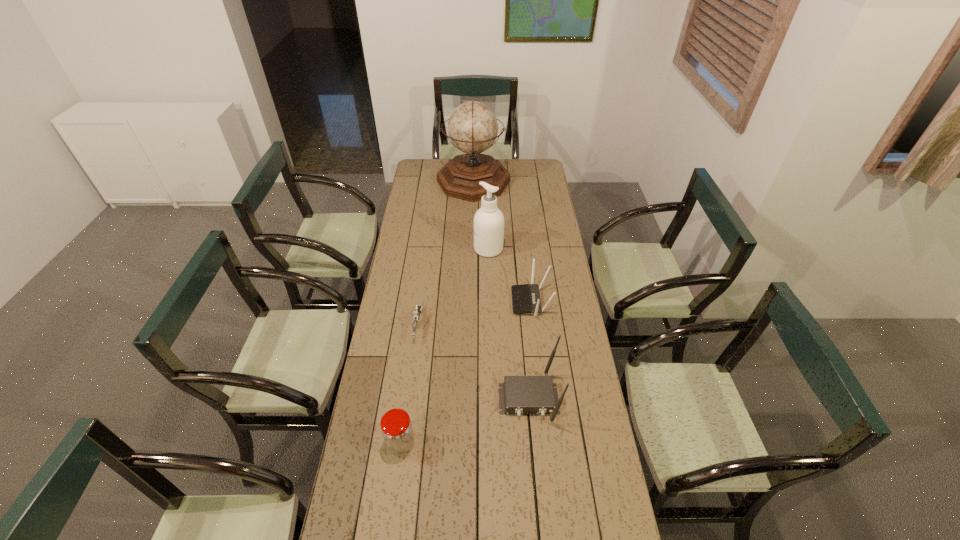
Locate an element on the screen. This screenshot has width=960, height=540. free location located 0.330m on the front label of the cleansing agent is located at coordinates (404, 249).

Find the location of a particular element. This screenshot has width=960, height=540. free space located 0.290m on the front label of the cleansing agent is located at coordinates (412, 249).

Locate an element on the screen. This screenshot has width=960, height=540. vacant space located 0.340m on the front label of the cleansing agent is located at coordinates (401, 249).

Identify the location of vacant space located 0.170m on the back of the fourth shortest object to connect cables. (536, 478).

Identify the location of blank space located 0.390m on the front-facing side of the shorter router. Image resolution: width=960 pixels, height=540 pixels. (419, 301).

I want to click on free region located 0.330m on the front-facing side of the shorter router, so click(433, 301).

At what (x,y) coordinates should I click in order to perform the action: click on vacant space located 0.150m on the front-facing side of the shorter router. Please return your answer as a coordinate pair (x, y). This screenshot has height=540, width=960. Looking at the image, I should click on (476, 301).

The image size is (960, 540). What are the coordinates of `vacant position located 0.070m on the back of the nearest object` in the screenshot? It's located at (405, 409).

Locate an element on the screen. vacant space located aimed along the barrel of the gun is located at coordinates (406, 414).

Identify the location of object that is positioned at the far edge. This screenshot has height=540, width=960. (472, 127).